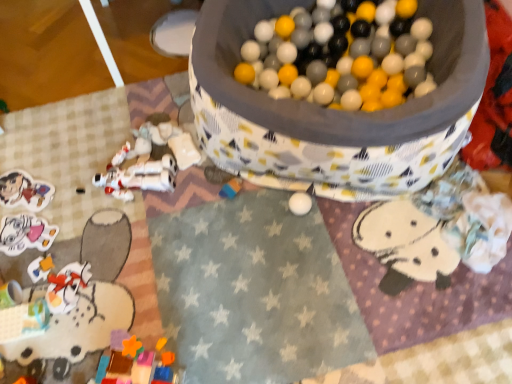
At what (x,y) coordinates should I click in order to perform the action: click on vacant space behind white plastic astronaut at lower left, placed as the 3th toy when sorted from right to left. Please return your answer as a coordinate pair (x, y). Looking at the image, I should click on (128, 122).